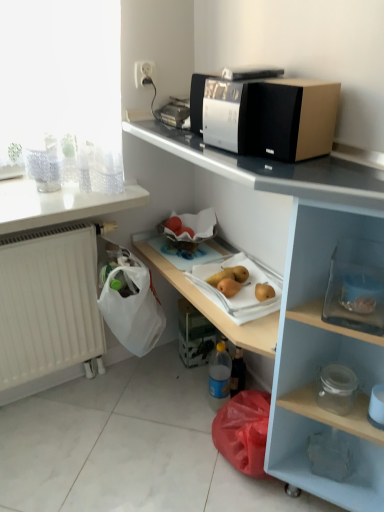
Question: Is white plastic socket at upper center positioned behind transparent glass jar at lower right, placed as the first appliance when sorted from bottom to top?

Choices:
 (A) yes
 (B) no

Answer: (A)

Question: Is there a large distance between white plastic socket at upper center and transparent glass jar at lower right, the first appliance viewed from the right?

Choices:
 (A) yes
 (B) no

Answer: (A)

Question: Can we say white plastic socket at upper center lies outside transparent glass jar at lower right, the 2th appliance from the top?

Choices:
 (A) no
 (B) yes

Answer: (B)

Question: Is white plastic socket at upper center in contact with transparent glass jar at lower right, the second appliance from the left?

Choices:
 (A) no
 (B) yes

Answer: (A)

Question: From the image's perspective, is white plastic socket at upper center under transparent glass jar at lower right, the second appliance from the left?

Choices:
 (A) no
 (B) yes

Answer: (A)

Question: In terms of width, does transparent glass container at lower right, the second box from the bottom, look wider or thinner when compared to white glossy countertop at upper left, which ranks as the 2th countertop in right-to-left order?

Choices:
 (A) thin
 (B) wide

Answer: (A)

Question: Considering the positions of transparent glass container at lower right, the second box from the bottom, and white glossy countertop at upper left, which ranks as the 2th countertop in right-to-left order, in the image, is transparent glass container at lower right, the second box from the bottom, taller or shorter than white glossy countertop at upper left, which ranks as the 2th countertop in right-to-left order,?

Choices:
 (A) short
 (B) tall

Answer: (B)

Question: Is transparent glass container at lower right, which appears as the 1th box when viewed from the right, bigger or smaller than white glossy countertop at upper left, which appears as the 1th countertop when viewed from the left?

Choices:
 (A) small
 (B) big

Answer: (A)

Question: In the image, is transparent glass container at lower right, the second box from the bottom, positioned in front of or behind white glossy countertop at upper left, which appears as the 1th countertop when viewed from the left?

Choices:
 (A) behind
 (B) front

Answer: (B)

Question: Is white glossy countertop at upper center, which is counted as the second countertop, starting from the left, wider or thinner than white glossy countertop at upper left, which appears as the 1th countertop when viewed from the left?

Choices:
 (A) thin
 (B) wide

Answer: (A)

Question: Is white glossy countertop at upper center, which is the first countertop from right to left, in front of or behind white glossy countertop at upper left, which ranks as the 2th countertop in right-to-left order, in the image?

Choices:
 (A) behind
 (B) front

Answer: (B)

Question: Is white glossy countertop at upper center, which is the first countertop from right to left, spatially inside white glossy countertop at upper left, which ranks as the 2th countertop in right-to-left order, or outside of it?

Choices:
 (A) outside
 (B) inside

Answer: (A)

Question: Visually, is white glossy countertop at upper center, which is counted as the second countertop, starting from the left, positioned to the left or to the right of white glossy countertop at upper left, which ranks as the 2th countertop in right-to-left order?

Choices:
 (A) right
 (B) left

Answer: (A)

Question: Would you say silver metallic microwave at upper center is to the left or to the right of yellow matte pears at center, which is counted as the 2th fruit, starting from the left, in the picture?

Choices:
 (A) left
 (B) right

Answer: (B)

Question: From a real-world perspective, is silver metallic microwave at upper center positioned above or below yellow matte pears at center, which is counted as the 2th fruit, starting from the left?

Choices:
 (A) below
 (B) above

Answer: (B)